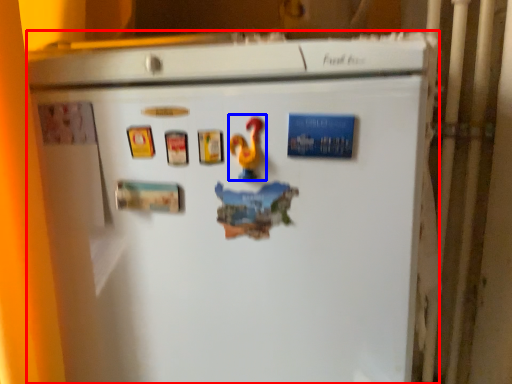
Question: Which object appears closest to the camera in this image, refrigerator (highlighted by a red box) or toy (highlighted by a blue box)?

Choices:
 (A) refrigerator
 (B) toy

Answer: (A)